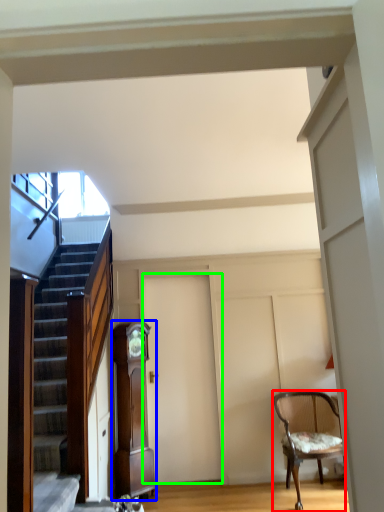
Question: Based on their relative distances, which object is farther from chair (highlighted by a red box)? Choose from cabinetry (highlighted by a blue box) and door (highlighted by a green box).

Choices:
 (A) cabinetry
 (B) door

Answer: (A)